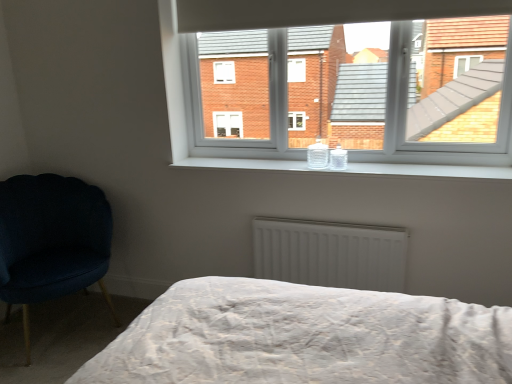
Question: Based on their sizes in the image, would you say white matte radiator at center is bigger or smaller than velvet dark blue chair at left?

Choices:
 (A) small
 (B) big

Answer: (A)

Question: Is point 351,284 closer or farther from the camera than point 10,210?

Choices:
 (A) closer
 (B) farther

Answer: (A)

Question: Based on their relative distances, which object is farther from the white matte radiator at center?

Choices:
 (A) velvet dark blue chair at left
 (B) white plastic window at upper center
 (C) white glossy window sill at center

Answer: (A)

Question: Which is farther from the white plastic window at upper center?

Choices:
 (A) white matte radiator at center
 (B) white glossy window sill at center
 (C) velvet dark blue chair at left

Answer: (C)